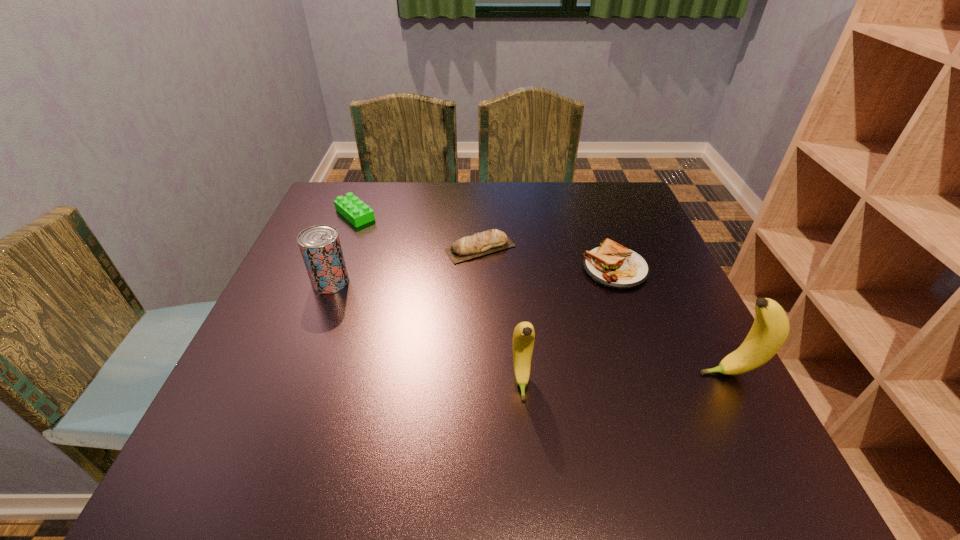
You are a GUI agent. You are given a task and a screenshot of the screen. Output one action in this format:
    pyautogui.click(x=<x>, y=<y>)
    Task: Click on the left banana
    Image resolution: width=960 pixels, height=540 pixels.
    Given the screenshot: What is the action you would take?
    pyautogui.click(x=524, y=335)

At what (x,y) coordinates should I click in order to perform the action: click on the right banana. Please return your answer as a coordinate pair (x, y). The height and width of the screenshot is (540, 960). Looking at the image, I should click on (770, 329).

What are the coordinates of `the taller banana` in the screenshot? It's located at (770, 329).

Locate an element on the screen. The width and height of the screenshot is (960, 540). the farthest object is located at coordinates (350, 207).

Where is `pita bread`? The width and height of the screenshot is (960, 540). pita bread is located at coordinates (465, 248).

Where is `sandwich`? sandwich is located at coordinates (613, 265).

Find the location of `beer can`. beer can is located at coordinates (320, 246).

This screenshot has height=540, width=960. I want to click on free point located from the stem of the right banana, so click(673, 373).

Where is `blank space located from the stem of the right banana`? The height and width of the screenshot is (540, 960). blank space located from the stem of the right banana is located at coordinates (596, 373).

Where is `free space located from the stem of the right banana`? This screenshot has height=540, width=960. free space located from the stem of the right banana is located at coordinates (624, 373).